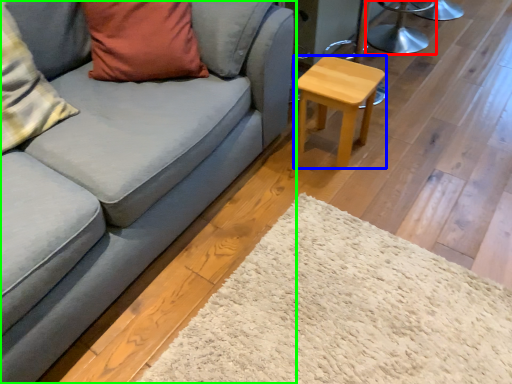
Question: Which object is positioned closest to swivel chair (highlighted by a red box)? Select from stool (highlighted by a blue box) and studio couch (highlighted by a green box).

Choices:
 (A) stool
 (B) studio couch

Answer: (A)